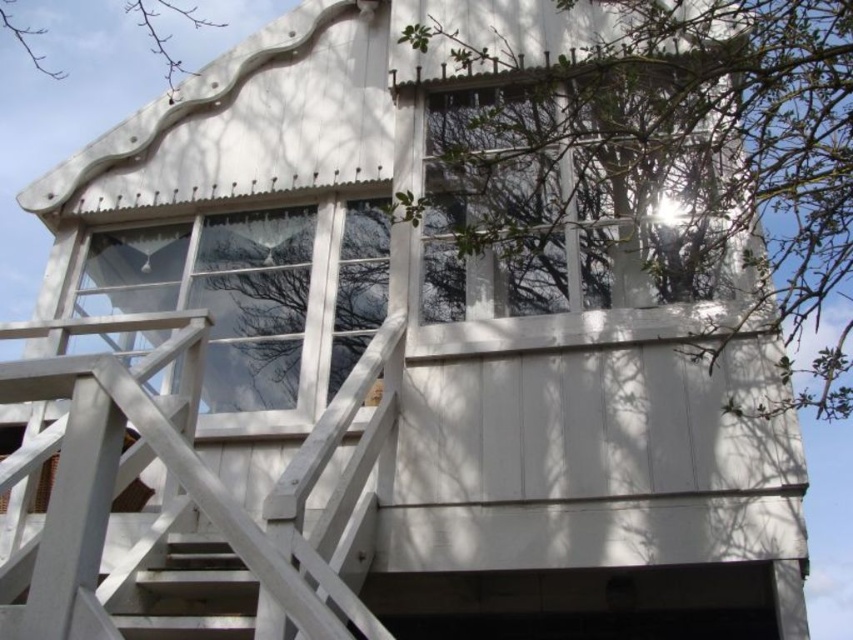
Looking at this image, between green leafy tree at upper right and clear glass window at center, which one appears on the right side from the viewer's perspective?

From the viewer's perspective, green leafy tree at upper right appears more on the right side.

Does green leafy tree at upper right appear under clear glass window at center?

Incorrect, green leafy tree at upper right is not positioned below clear glass window at center.

The image size is (853, 640). Describe the element at coordinates (677, 150) in the screenshot. I see `green leafy tree at upper right` at that location.

Find the location of `green leafy tree at upper right`. green leafy tree at upper right is located at coordinates (677, 150).

Can you confirm if clear glass window at center is smaller than bare branches at upper left?

Incorrect, clear glass window at center is not smaller in size than bare branches at upper left.

Find the location of a particular element. clear glass window at center is located at coordinates (256, 294).

Identify the location of clear glass window at center. This screenshot has width=853, height=640. (256, 294).

Who is taller, white wooden staircase at center or bare branches at upper left?

bare branches at upper left is taller.

Is point (49, 378) farther from camera compared to point (161, 36)?

No, it is in front of (161, 36).

Which is behind, point (364, 496) or point (33, 45)?

Point (33, 45)

The height and width of the screenshot is (640, 853). I want to click on white wooden staircase at center, so click(181, 499).